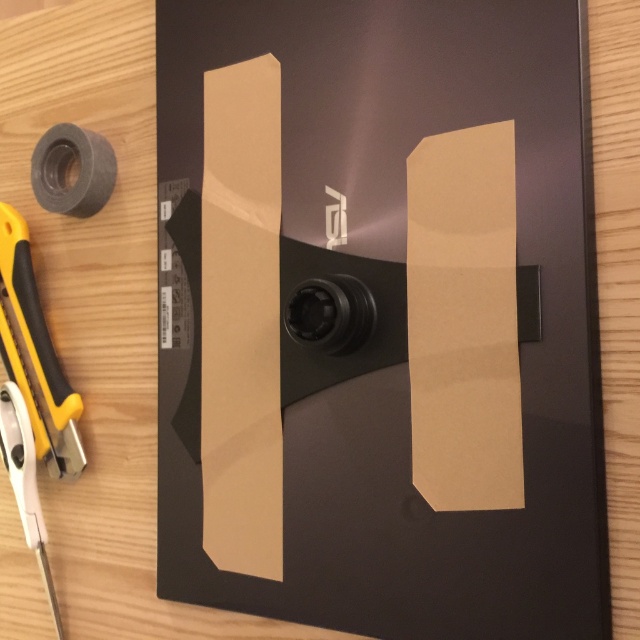
Question: Can you confirm if brown matte cardboard at center is thinner than gray matte tape at upper left?

Choices:
 (A) no
 (B) yes

Answer: (A)

Question: Among these objects, which one is farthest from the camera?

Choices:
 (A) gray matte tape at upper left
 (B) brown matte cardboard at center

Answer: (A)

Question: Can you confirm if brown matte cardboard at center is positioned below gray matte tape at upper left?

Choices:
 (A) yes
 (B) no

Answer: (A)

Question: Which object appears closest to the camera in this image?

Choices:
 (A) gray matte tape at upper left
 (B) brown matte cardboard at center

Answer: (B)

Question: Is brown matte cardboard at center bigger than gray matte tape at upper left?

Choices:
 (A) no
 (B) yes

Answer: (B)